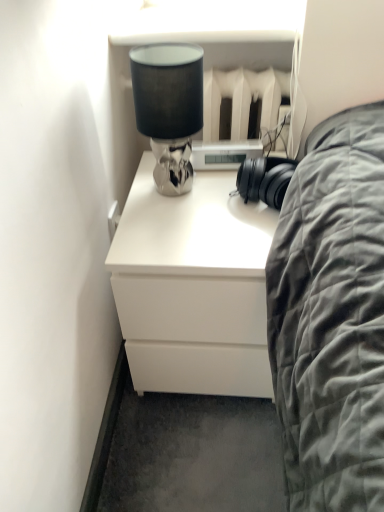
Find the location of a particular element. This screenshot has width=384, height=512. free point below satin silver lamp at upper center (from a real-world perspective) is located at coordinates (182, 190).